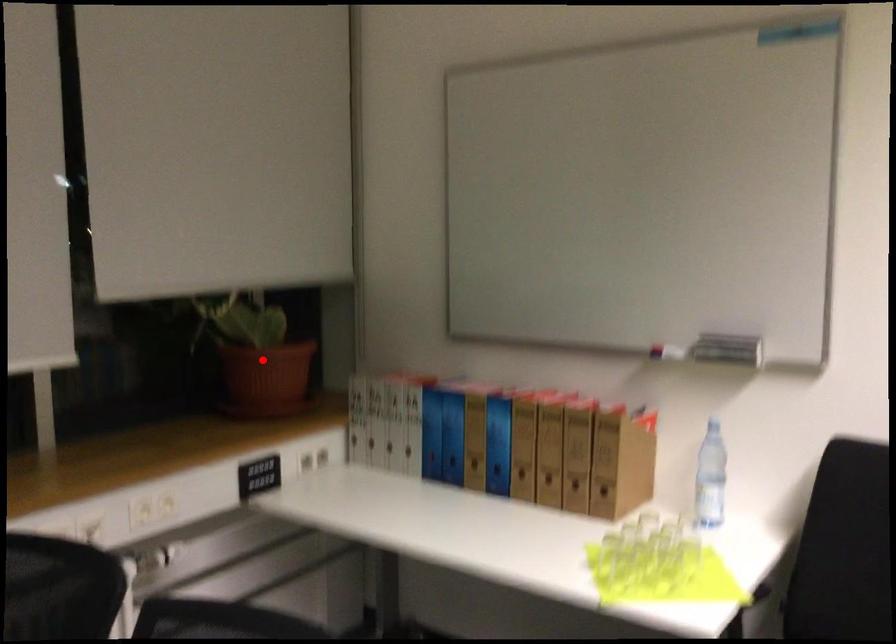
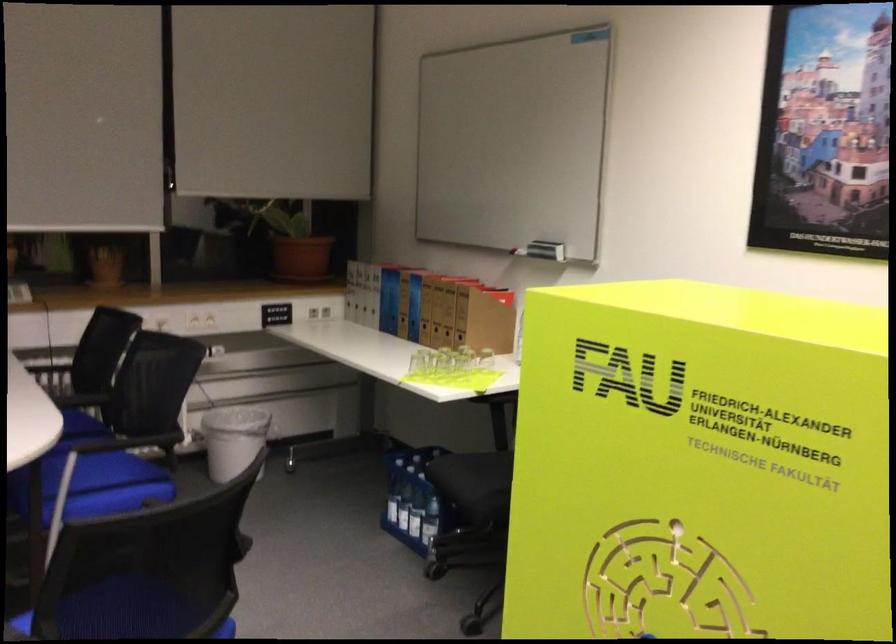
In the second image, find the point that corresponds to the highlighted location in the first image.

(294, 243)